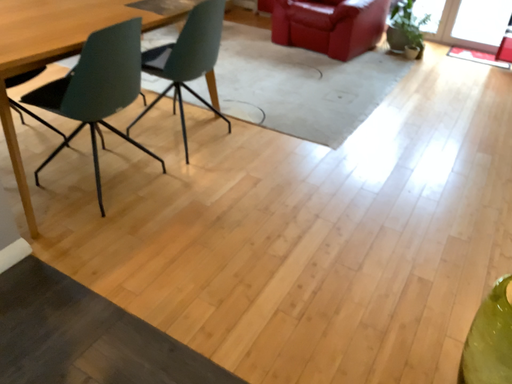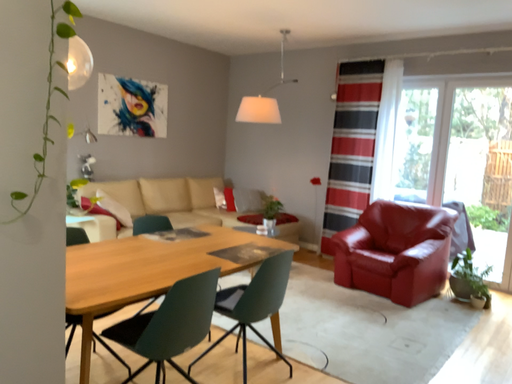
Question: How did the camera likely rotate when shooting the video?

Choices:
 (A) rotated left
 (B) rotated right

Answer: (A)